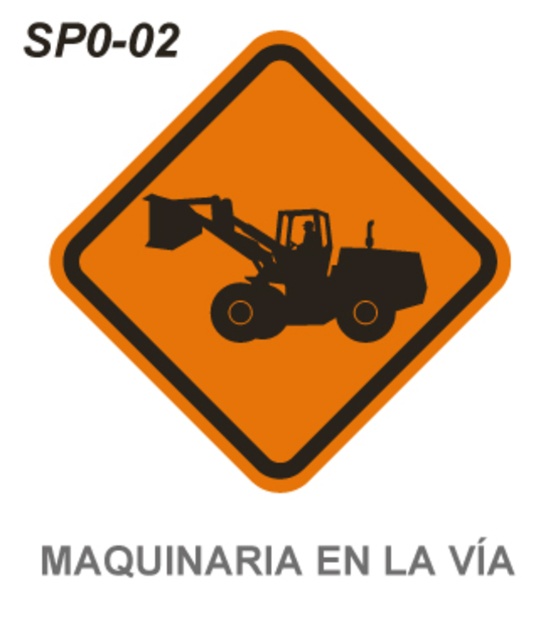
Question: Which point is closer to the camera?

Choices:
 (A) black silhouette tractor at center
 (B) orange matte/black textured construction equipment at center

Answer: (B)

Question: Can you confirm if orange matte/black textured construction equipment at center is positioned to the right of black silhouette tractor at center?

Choices:
 (A) yes
 (B) no

Answer: (A)

Question: Does orange matte/black textured construction equipment at center have a smaller size compared to black silhouette tractor at center?

Choices:
 (A) no
 (B) yes

Answer: (A)

Question: Can you confirm if orange matte/black textured construction equipment at center is positioned above black silhouette tractor at center?

Choices:
 (A) no
 (B) yes

Answer: (B)